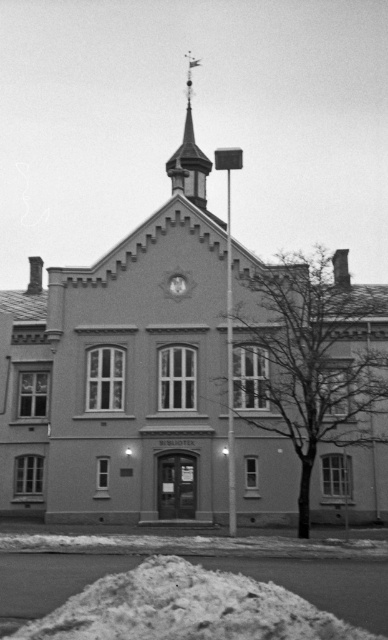
Measure the distance between polished brass spire at upper center and metallic clock at center.

polished brass spire at upper center and metallic clock at center are 71.32 feet apart.

Is polished brass spire at upper center positioned before metallic clock at center?

No, polished brass spire at upper center is behind metallic clock at center.

Is point (190, 193) more distant than point (180, 275)?

Yes, it is behind point (180, 275).

The height and width of the screenshot is (640, 388). I want to click on polished brass spire at upper center, so click(190, 154).

Is white powdery snow at lower center above polished brass spire at upper center?

No, white powdery snow at lower center is not above polished brass spire at upper center.

Can you confirm if white powdery snow at lower center is wider than polished brass spire at upper center?

Yes, white powdery snow at lower center is wider than polished brass spire at upper center.

Which is in front, point (382, 576) or point (187, 77)?

Positioned in front is point (382, 576).

You are a GUI agent. You are given a task and a screenshot of the screen. Output one action in this format:
    pyautogui.click(x=<x>, y=<y>)
    Task: Click on the white powdery snow at lower center
    The height and width of the screenshot is (640, 388).
    Given the screenshot: What is the action you would take?
    pyautogui.click(x=332, y=584)

Which of these two, white powdery snow at lower center or metallic clock at center, stands shorter?

metallic clock at center is shorter.

At what (x,y) coordinates should I click in order to perform the action: click on white powdery snow at lower center. Please return your answer as a coordinate pair (x, y). Looking at the image, I should click on (332, 584).

Which is behind, point (244, 561) or point (171, 285)?

The point (171, 285) is more distant.

The image size is (388, 640). What are the coordinates of `white powdery snow at lower center` in the screenshot? It's located at (332, 584).